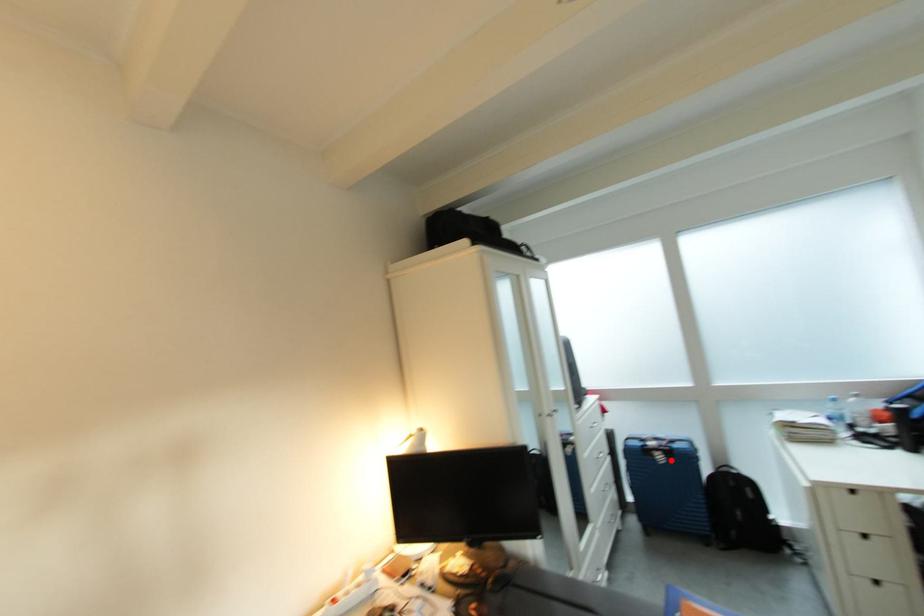
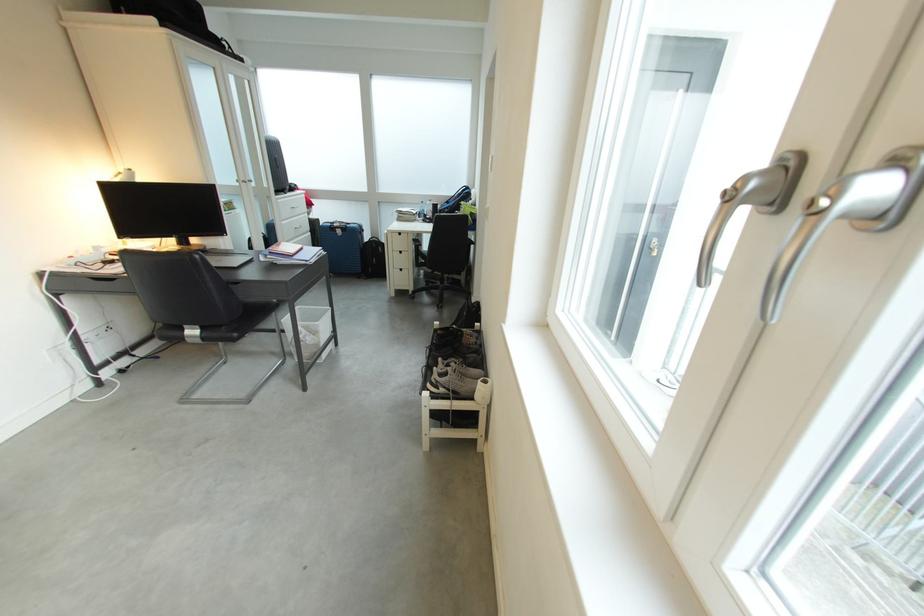
Locate, in the second image, the point that corresponds to the highlighted location in the first image.

(350, 235)